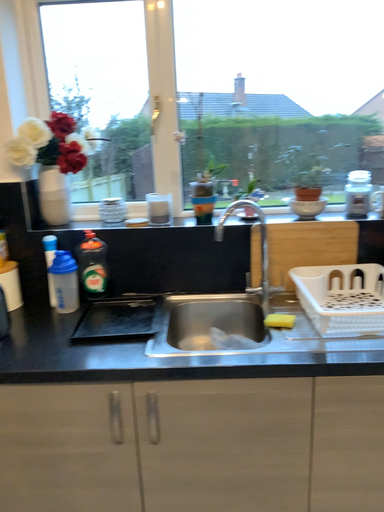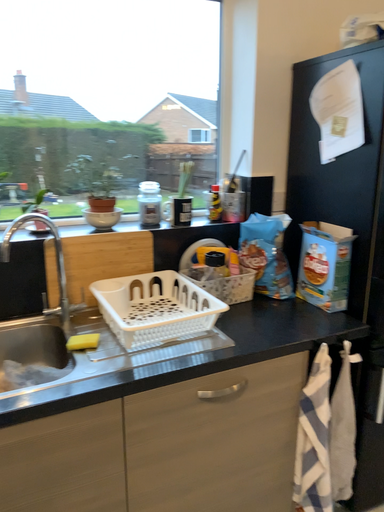
Question: How did the camera likely rotate when shooting the video?

Choices:
 (A) rotated right
 (B) rotated left

Answer: (A)